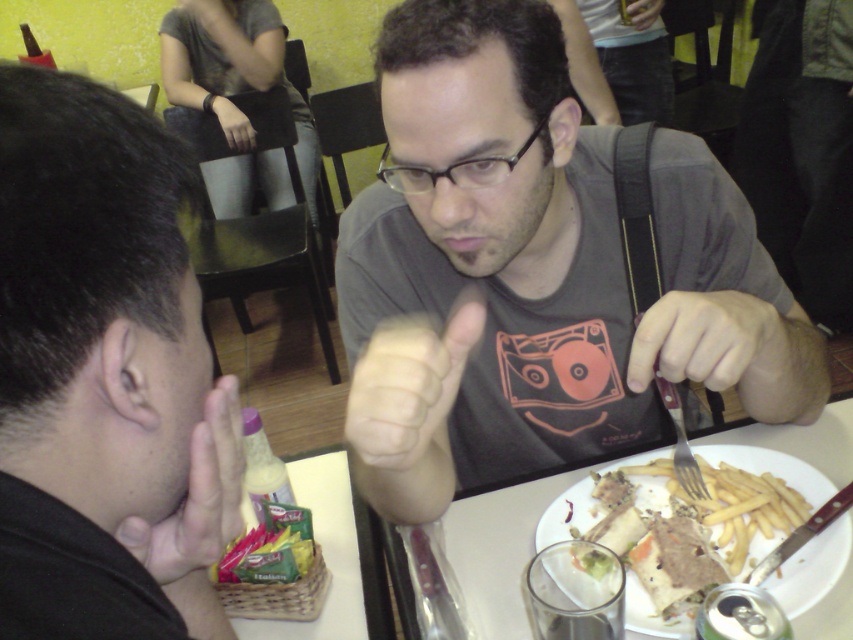
Question: Which point is closer to the camera?

Choices:
 (A) (447, 436)
 (B) (666, 403)
 (C) (660, 512)

Answer: (B)

Question: Which of the following is the farthest from the observer?

Choices:
 (A) (41, 628)
 (B) (689, 484)

Answer: (B)

Question: Is metallic knife at right to the right of silver metallic fork at upper right from the viewer's perspective?

Choices:
 (A) yes
 (B) no

Answer: (A)

Question: Which of these objects is positioned closest to the matte plastic plate at center?

Choices:
 (A) smooth skin hand at lower left
 (B) black matte shirt at upper center

Answer: (A)

Question: Considering the relative positions of matte gray t-shirt at center and smooth skin hand at lower left in the image provided, where is matte gray t-shirt at center located with respect to smooth skin hand at lower left?

Choices:
 (A) above
 (B) below

Answer: (A)

Question: Is matte skin hand at center to the left of metallic knife at right from the viewer's perspective?

Choices:
 (A) no
 (B) yes

Answer: (B)